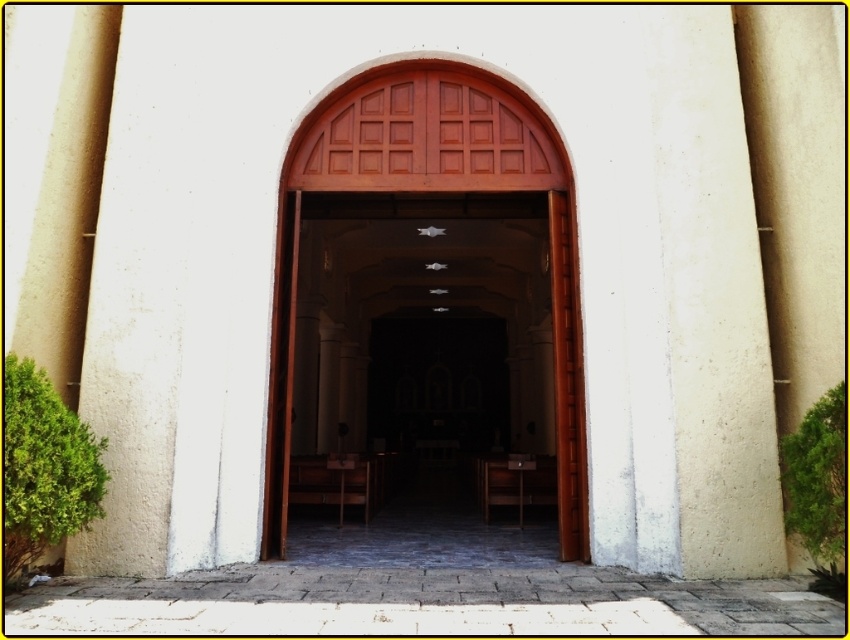
Question: Observing the image, what is the correct spatial positioning of smooth wood door at center in reference to wooden chair at center?

Choices:
 (A) above
 (B) below

Answer: (A)

Question: Estimate the real-world distances between objects in this image. Which object is farther from the wooden chair at center?

Choices:
 (A) smooth wood door at center
 (B) smooth beige pillar at right
 (C) brown wooden chair at center

Answer: (B)

Question: Which point appears closest to the camera in this image?

Choices:
 (A) (348, 483)
 (B) (293, 451)
 (C) (75, 172)
 (D) (701, 509)

Answer: (D)

Question: Can you confirm if beige concrete pillar at right is bigger than smooth beige pillar at left?

Choices:
 (A) yes
 (B) no

Answer: (B)

Question: Is the position of beige concrete pillar at right more distant than that of brown wooden chair at center?

Choices:
 (A) yes
 (B) no

Answer: (B)

Question: Which object is positioned closest to the wooden chair at center?

Choices:
 (A) beige concrete pillar at right
 (B) smooth beige pillar at left
 (C) smooth wood door at center

Answer: (B)